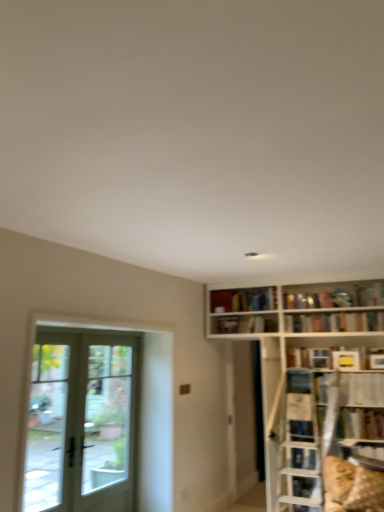
Question: Relative to white matte bookshelf at upper center, which is counted as the third book, starting from the top, is clear glass door at left in front or behind?

Choices:
 (A) behind
 (B) front

Answer: (B)

Question: From the image's perspective, relative to white matte bookshelf at upper center, which ranks as the first book in left-to-right order, is clear glass door at left above or below?

Choices:
 (A) below
 (B) above

Answer: (A)

Question: Which object is positioned closest to the yellow matte bookshelf at upper right, placed as the fourth book when sorted from left to right?

Choices:
 (A) white matte bookshelf at upper center, which ranks as the first book in left-to-right order
 (B) clear glass door at left
 (C) white plastic shelf at upper right
 (D) hardcover book at upper right, marked as the 1th book in a bottom-to-top arrangement
 (E) clear glass door at left

Answer: (C)

Question: Which object is the farthest from the matte white bookshelf at upper right, the first book from the right?

Choices:
 (A) hardcover book at upper right, which is counted as the fifth book, starting from the top
 (B) white plastic shelf at upper right
 (C) clear glass door at left
 (D) white matte bookshelf at upper center, which ranks as the first book in left-to-right order
 (E) clear glass door at left

Answer: (E)